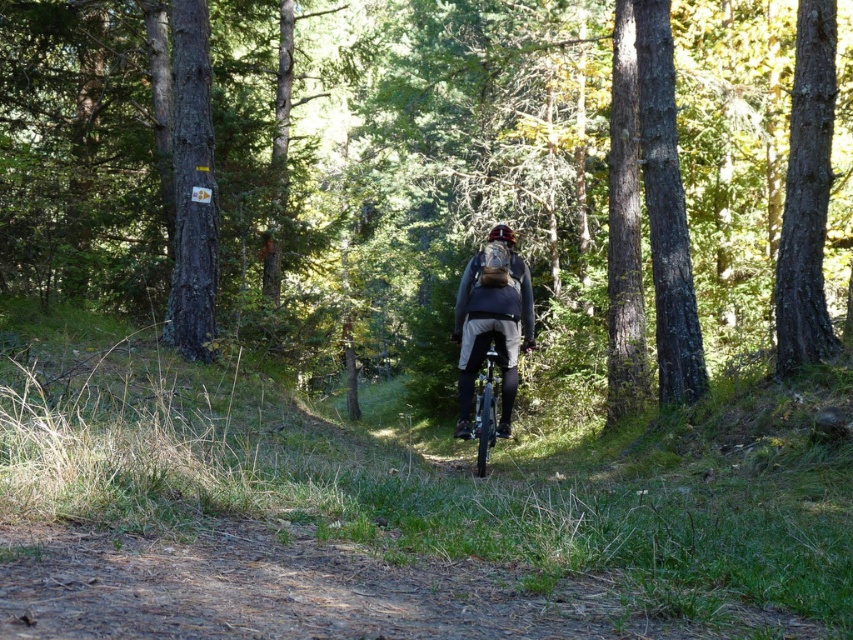
Is matte gray jacket at center to the left of shiny silver bicycle at center from the viewer's perspective?

Incorrect, matte gray jacket at center is not on the left side of shiny silver bicycle at center.

Between matte gray jacket at center and shiny silver bicycle at center, which one is positioned higher?

matte gray jacket at center is higher up.

Image resolution: width=853 pixels, height=640 pixels. Describe the element at coordinates (491, 324) in the screenshot. I see `matte gray jacket at center` at that location.

Locate an element on the screen. The height and width of the screenshot is (640, 853). matte gray jacket at center is located at coordinates (491, 324).

Who is lower down, shiny silver bicycle at center or matte black helmet at center?

Positioned lower is shiny silver bicycle at center.

Which is in front, point (490, 440) or point (489, 237)?

Point (489, 237) is in front.

Where is `shiny silver bicycle at center`? The width and height of the screenshot is (853, 640). shiny silver bicycle at center is located at coordinates (485, 412).

Can you confirm if green matte forest at center is bigger than shiny silver bicycle at center?

Yes, green matte forest at center is bigger than shiny silver bicycle at center.

Does green matte forest at center have a greater width compared to shiny silver bicycle at center?

Yes, green matte forest at center is wider than shiny silver bicycle at center.

Who is more forward, (x=720, y=3) or (x=485, y=465)?

Positioned in front is point (x=485, y=465).

Where is `green matte forest at center`? This screenshot has height=640, width=853. green matte forest at center is located at coordinates (437, 177).